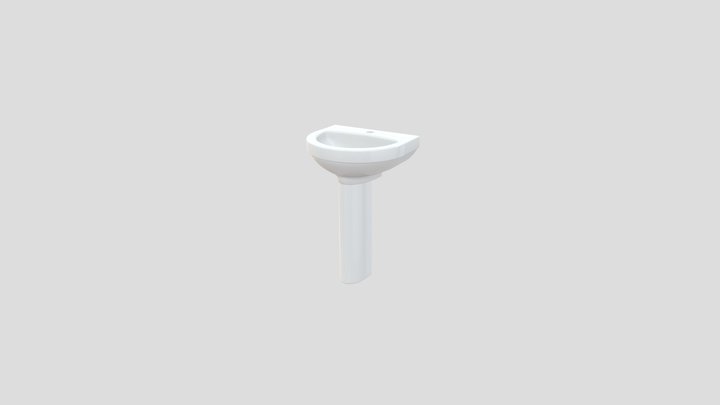
Find the location of `grey portion sink`. grey portion sink is located at coordinates (342, 167).